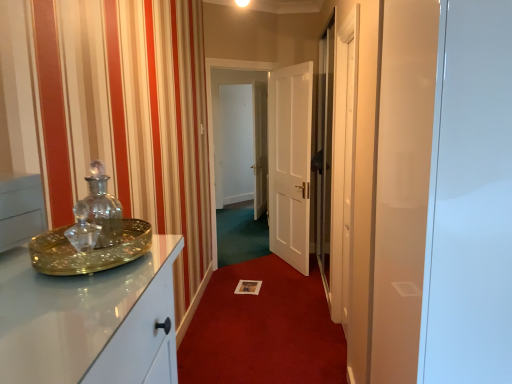
Question: Is white paper at center beside matte glass tray at left?

Choices:
 (A) no
 (B) yes

Answer: (A)

Question: Is white paper at center far from matte glass tray at left?

Choices:
 (A) yes
 (B) no

Answer: (A)

Question: Could you tell me if white paper at center is turned towards matte glass tray at left?

Choices:
 (A) no
 (B) yes

Answer: (A)

Question: Is matte glass tray at left completely or partially inside white paper at center?

Choices:
 (A) no
 (B) yes

Answer: (A)

Question: Considering the relative sizes of white paper at center and matte glass tray at left in the image provided, is white paper at center shorter than matte glass tray at left?

Choices:
 (A) no
 (B) yes

Answer: (B)

Question: In terms of size, does transparent glass door at center, which appears as the first glass door when viewed from the left, appear bigger or smaller than white wooden door at center?

Choices:
 (A) big
 (B) small

Answer: (A)

Question: Considering the positions of point (295, 167) and point (269, 190), is point (295, 167) closer or farther from the camera than point (269, 190)?

Choices:
 (A) farther
 (B) closer

Answer: (B)

Question: Would you say transparent glass door at center, the second glass door viewed from the front, is to the left or to the right of white wooden door at center in the picture?

Choices:
 (A) left
 (B) right

Answer: (A)

Question: Is transparent glass door at center, the second glass door viewed from the front, spatially inside white wooden door at center, or outside of it?

Choices:
 (A) inside
 (B) outside

Answer: (B)

Question: Is transparent glass door at right, the first glass door positioned from the front, to the left or to the right of matte glass tray at left in the image?

Choices:
 (A) left
 (B) right

Answer: (B)

Question: In terms of height, does transparent glass door at right, which appears as the first glass door when viewed from the right, look taller or shorter compared to matte glass tray at left?

Choices:
 (A) tall
 (B) short

Answer: (A)

Question: Looking at their shapes, would you say transparent glass door at right, the first glass door positioned from the front, is wider or thinner than matte glass tray at left?

Choices:
 (A) wide
 (B) thin

Answer: (A)

Question: From a real-world perspective, relative to matte glass tray at left, is transparent glass door at right, marked as the 2th glass door in a back-to-front arrangement, vertically above or below?

Choices:
 (A) below
 (B) above

Answer: (A)

Question: In terms of size, does matte glass tray at left appear bigger or smaller than white paper at center?

Choices:
 (A) big
 (B) small

Answer: (B)

Question: Relative to white paper at center, is matte glass tray at left in front or behind?

Choices:
 (A) front
 (B) behind

Answer: (A)